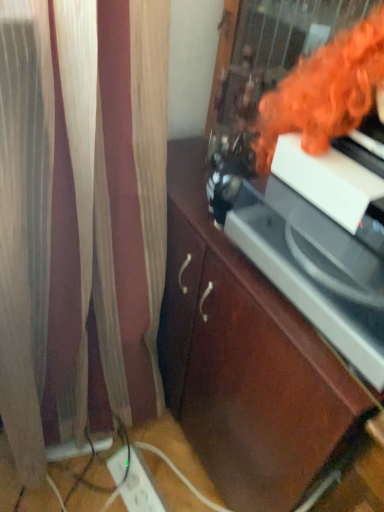
Question: From the image's perspective, is orange fabric at upper right below white plastic extension cord at lower left?

Choices:
 (A) yes
 (B) no

Answer: (B)

Question: Is orange fabric at upper right bigger than white plastic extension cord at lower left?

Choices:
 (A) yes
 (B) no

Answer: (A)

Question: Does orange fabric at upper right have a smaller size compared to white plastic extension cord at lower left?

Choices:
 (A) no
 (B) yes

Answer: (A)

Question: Is orange fabric at upper right shorter than white plastic extension cord at lower left?

Choices:
 (A) yes
 (B) no

Answer: (B)

Question: Does orange fabric at upper right appear on the left side of white plastic extension cord at lower left?

Choices:
 (A) yes
 (B) no

Answer: (B)

Question: Does orange fabric at upper right have a greater height compared to white plastic extension cord at lower left?

Choices:
 (A) yes
 (B) no

Answer: (A)

Question: Can you confirm if white plastic extension cord at lower left is shorter than orange fabric at upper right?

Choices:
 (A) yes
 (B) no

Answer: (A)

Question: Considering the relative positions of white plastic extension cord at lower left and orange fabric at upper right in the image provided, is white plastic extension cord at lower left to the right of orange fabric at upper right from the viewer's perspective?

Choices:
 (A) no
 (B) yes

Answer: (A)

Question: Does white plastic extension cord at lower left have a greater width compared to orange fabric at upper right?

Choices:
 (A) no
 (B) yes

Answer: (A)

Question: Is white plastic extension cord at lower left thinner than orange fabric at upper right?

Choices:
 (A) no
 (B) yes

Answer: (B)

Question: Could you tell me if white plastic extension cord at lower left is turned towards orange fabric at upper right?

Choices:
 (A) no
 (B) yes

Answer: (A)

Question: Can you confirm if white plastic extension cord at lower left is smaller than orange fabric at upper right?

Choices:
 (A) yes
 (B) no

Answer: (A)

Question: From a real-world perspective, is brown wood cabinet at center positioned over white plastic extension cord at lower left based on gravity?

Choices:
 (A) no
 (B) yes

Answer: (B)